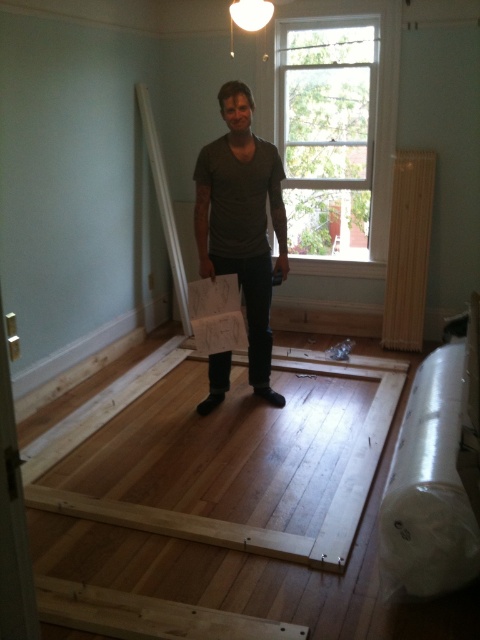
You are a contractor standing in the room and need to determine if the white wood window at upper center can fit a new air conditioner unit that requires a minimum height of 1.8 meters. Given that the matte gray shirt at center is 1.7 meters tall, can the window accommodate the unit?

The white wood window at upper center is shorter than the matte gray shirt at center, which is 1.7 meters tall. Since the window is shorter than 1.7 meters, it cannot accommodate the air conditioner unit requiring a minimum height of 1.8 meters.

You are a contractor planning to install a new air conditioner unit on the wall. The unit requires a space that is at least as large as the matte gray shirt at center. Can the white wood window at upper center accommodate the air conditioner unit?

The white wood window at upper center is bigger than the matte gray shirt at center, so yes, the window can accommodate the air conditioner unit since it is larger than the required space.

You are an architect standing in the room and need to place a large poster on the wall opposite the white wood window at upper center. Which wall should you choose?

The white wood window at upper center is located at point (333, 132), so the wall opposite would be the one facing away from that window. Since the window is at the upper center, the opposite wall is likely the lower wall, but without more specific spatial data, the safest choice is the wall directly across from the window.